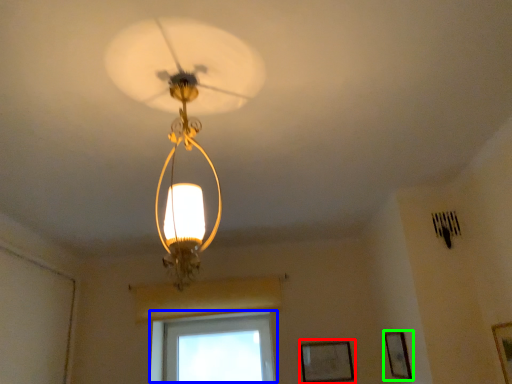
Question: Which object is the closest to the picture frame (highlighted by a red box)? Choose among these: window (highlighted by a blue box) or picture frame (highlighted by a green box).

Choices:
 (A) window
 (B) picture frame

Answer: (B)